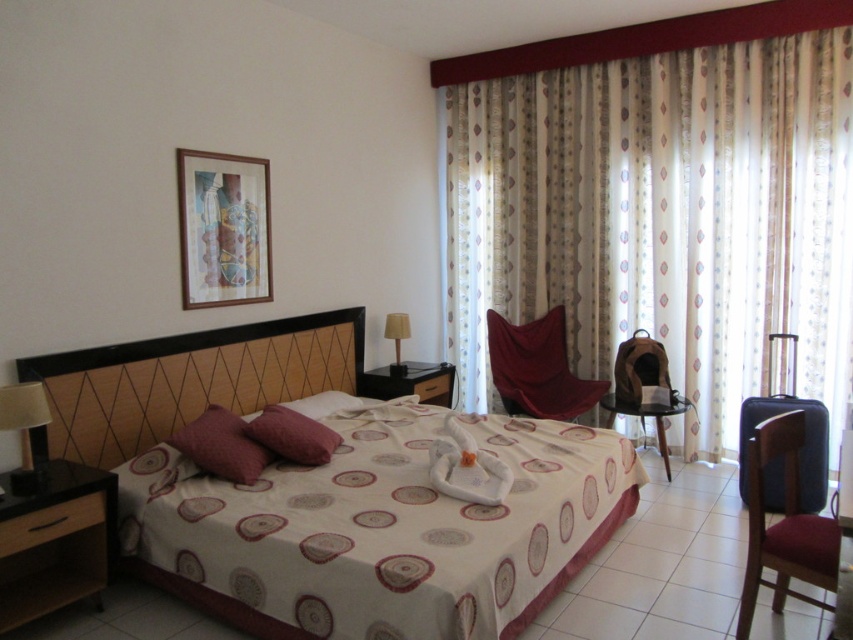
Does patterned fabric curtain at center have a lesser width compared to velvet red armchair at center?

No.

Who is more distant from viewer, (653, 266) or (497, 376)?

Positioned behind is point (497, 376).

Does point (471, 216) lie behind point (519, 368)?

Yes.

I want to click on patterned fabric curtain at center, so click(x=660, y=218).

Which is behind, point (784, 586) or point (514, 362)?

Point (514, 362)

The width and height of the screenshot is (853, 640). What do you see at coordinates (782, 524) in the screenshot?
I see `velvet maroon chair at right` at bounding box center [782, 524].

You are a GUI agent. You are given a task and a screenshot of the screen. Output one action in this format:
    pyautogui.click(x=<x>, y=<y>)
    Task: Click on the velvet maroon chair at right
    
    Given the screenshot: What is the action you would take?
    pyautogui.click(x=782, y=524)

Which is below, velvet-like red pillow at center-left or black plastic stool at center?

black plastic stool at center is below.

Is velvet-like red pillow at center-left taller than black plastic stool at center?

In fact, velvet-like red pillow at center-left may be shorter than black plastic stool at center.

Describe the element at coordinates (221, 445) in the screenshot. I see `velvet-like red pillow at center-left` at that location.

Locate an element on the screen. velvet-like red pillow at center-left is located at coordinates (221, 445).